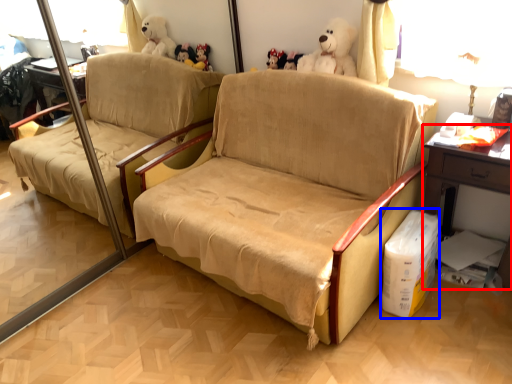
Question: Among these objects, which one is nearest to the camera, table (highlighted by a red box) or cardboard box (highlighted by a blue box)?

Choices:
 (A) table
 (B) cardboard box

Answer: (A)